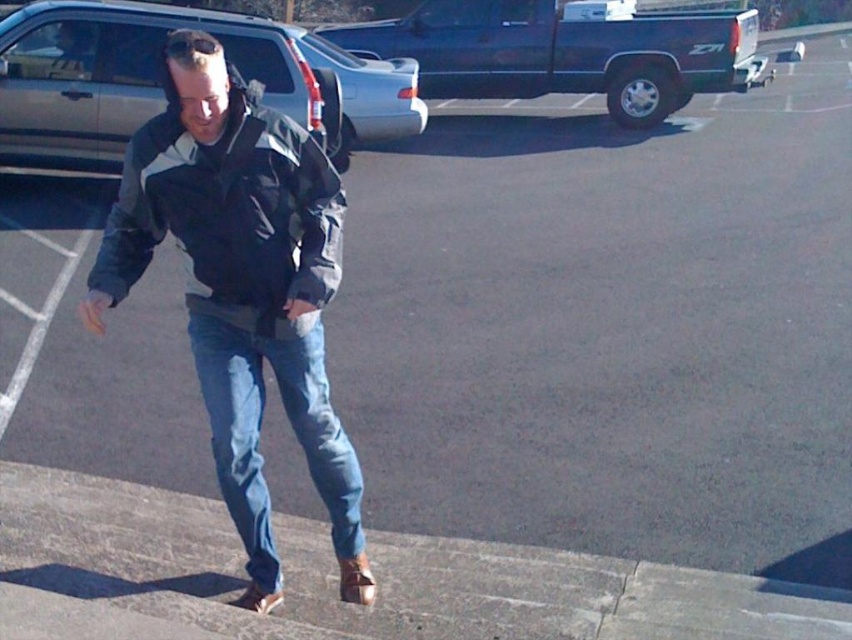
Question: Is silver metallic suv at upper left above denim at center?

Choices:
 (A) yes
 (B) no

Answer: (A)

Question: Which of the following is the farthest from the observer?

Choices:
 (A) silver metallic suv at upper left
 (B) denim jeans at center
 (C) metallic blue truck at upper center
 (D) concrete at lower left

Answer: (C)

Question: Which object is the farthest from the concrete at lower left?

Choices:
 (A) denim jeans at center
 (B) silver metallic suv at upper left
 (C) denim at center
 (D) metallic blue truck at upper center

Answer: (D)

Question: Does metallic blue truck at upper center have a larger size compared to denim at center?

Choices:
 (A) yes
 (B) no

Answer: (B)

Question: Based on their relative distances, which object is farther from the metallic blue truck at upper center?

Choices:
 (A) concrete at lower left
 (B) silver metallic suv at upper left
 (C) denim at center

Answer: (C)

Question: Does silver metallic suv at upper left appear over denim at center?

Choices:
 (A) yes
 (B) no

Answer: (A)